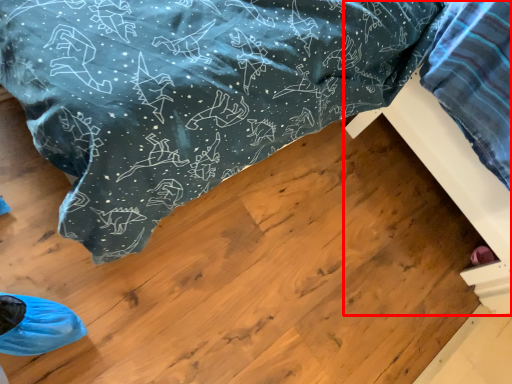
Question: From the image, what is the correct spatial relationship of furniture (annotated by the red box) in relation to furniture?

Choices:
 (A) left
 (B) right

Answer: (B)